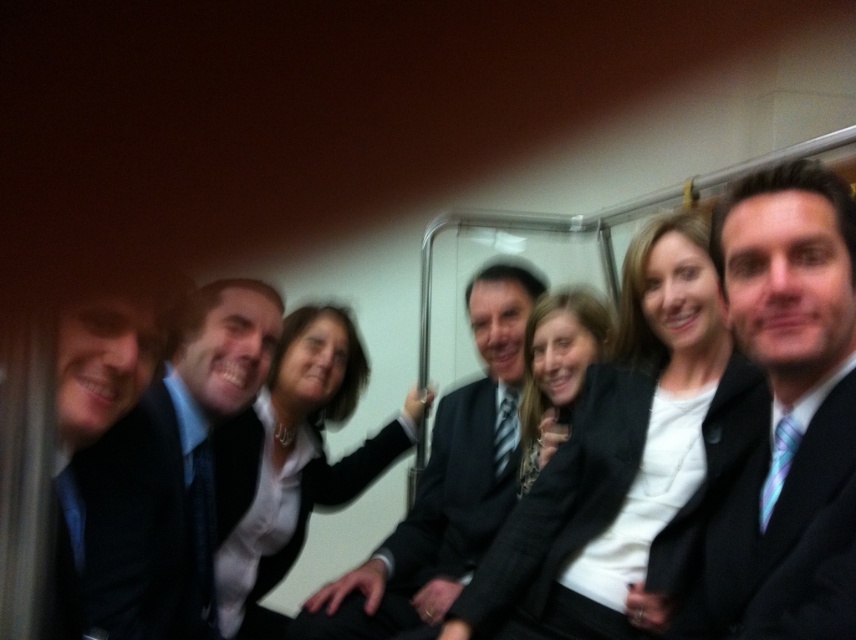
Question: Which object is the farthest from the matte black suit at left?

Choices:
 (A) white glossy shirt at center
 (B) matte black blazer at center

Answer: (B)

Question: Which point appears closest to the camera in this image?

Choices:
 (A) (94, 454)
 (B) (706, 444)
 (C) (342, 476)

Answer: (A)

Question: Estimate the real-world distances between objects in this image. Which object is closer to the white textured blazer at center?

Choices:
 (A) black suit at center
 (B) dark gray suit at center

Answer: (B)

Question: In this image, where is white glossy shirt at center located relative to matte black blazer at center?

Choices:
 (A) right
 (B) left

Answer: (B)

Question: Does matte black suit at left appear under white glossy shirt at center?

Choices:
 (A) no
 (B) yes

Answer: (A)

Question: Is matte black suit at left wider than dark gray suit at center?

Choices:
 (A) yes
 (B) no

Answer: (B)